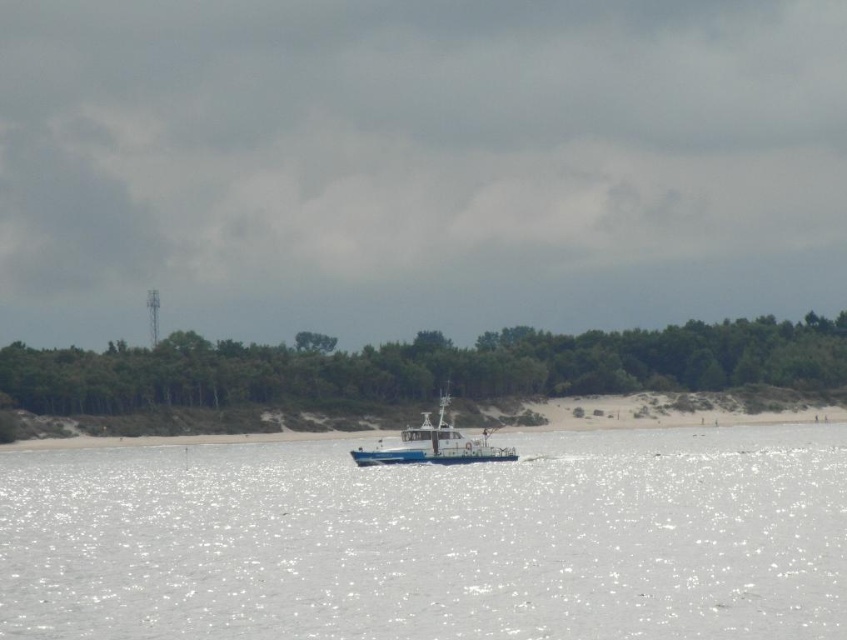
Question: Which point is closer to the camera?

Choices:
 (A) white glossy boat at center
 (B) white glossy water at center

Answer: (B)

Question: Which point appears closest to the camera in this image?

Choices:
 (A) (425, 444)
 (B) (191, 449)

Answer: (A)

Question: Does white glossy water at center lie in front of white glossy boat at center?

Choices:
 (A) yes
 (B) no

Answer: (A)

Question: Which of the following is the farthest from the observer?

Choices:
 (A) white glossy boat at center
 (B) white glossy water at center

Answer: (A)

Question: Is white glossy water at center thinner than white glossy boat at center?

Choices:
 (A) no
 (B) yes

Answer: (A)

Question: Is white glossy water at center to the left of white glossy boat at center from the viewer's perspective?

Choices:
 (A) yes
 (B) no

Answer: (B)